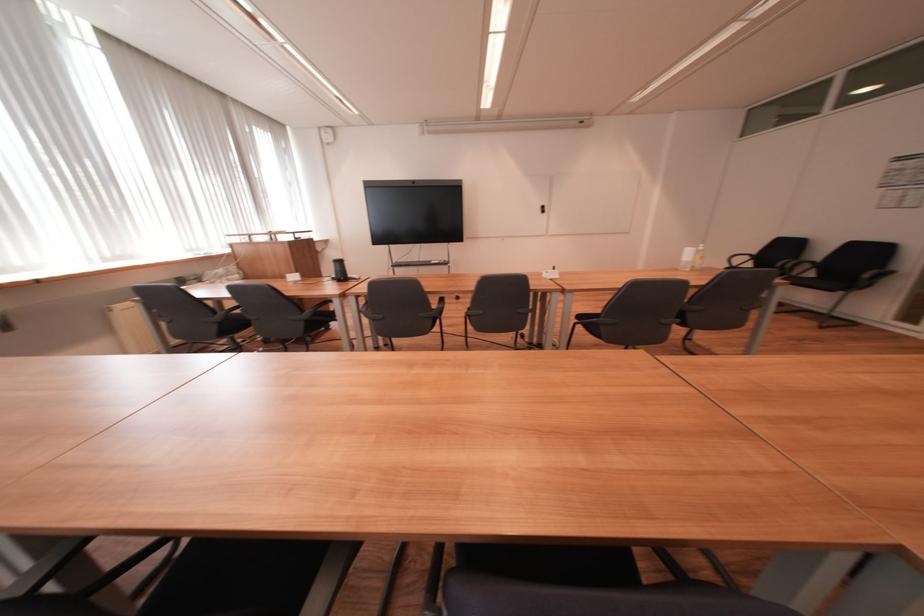
This screenshot has width=924, height=616. I want to click on hand sanitizer bottle, so click(699, 256).